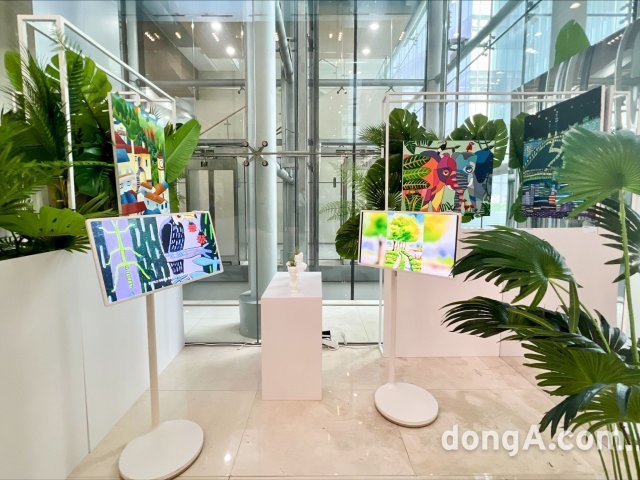
Identify the location of monitor displays. click(157, 254), click(418, 247).